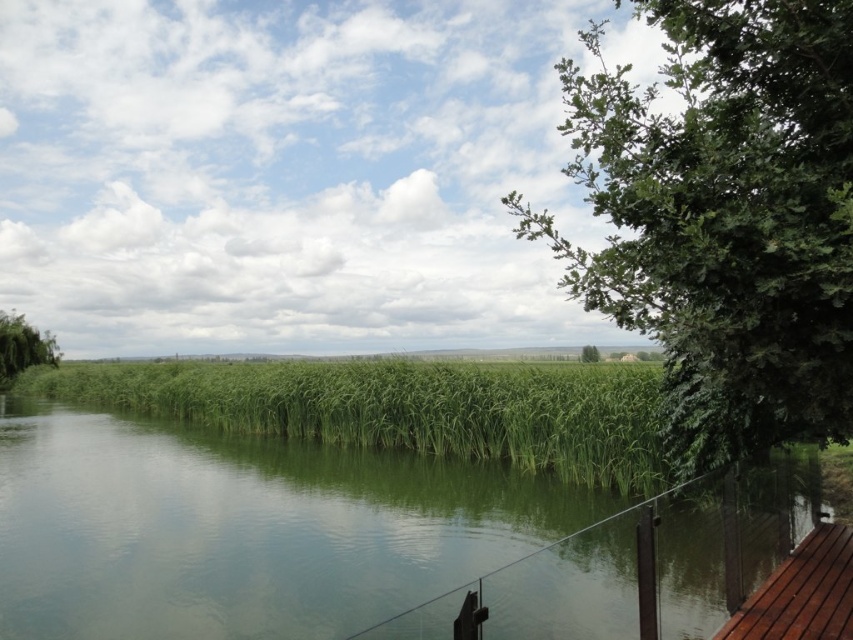
Is point (431, 614) behind point (598, 349)?

That is False.

Can you confirm if green grassy river at center is positioned above green leafy tree at center?

No.

This screenshot has width=853, height=640. I want to click on green grassy river at center, so click(x=241, y=529).

Is green leafy tree at right closer to camera compared to brown wooden deck at lower right?

Yes, green leafy tree at right is closer to the viewer.

Between green leafy tree at right and brown wooden deck at lower right, which one is positioned higher?

Positioned higher is green leafy tree at right.

Locate an element on the screen. This screenshot has width=853, height=640. green leafy tree at right is located at coordinates (724, 220).

Is point (721, 513) positioned in front of point (833, 193)?

No, (721, 513) is further to viewer.

Who is lower down, green grassy river at center or green leafy tree at right?

Positioned lower is green grassy river at center.

Locate an element on the screen. green grassy river at center is located at coordinates (241, 529).

Locate an element on the screen. This screenshot has width=853, height=640. green grassy river at center is located at coordinates (241, 529).